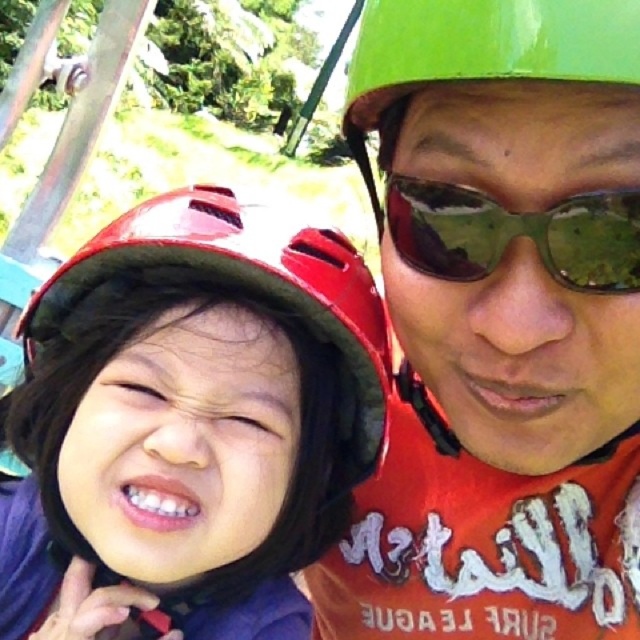
Which of these two, glossy red helmet at left or green reflective sunglasses at upper center, stands shorter?

green reflective sunglasses at upper center is shorter.

Identify the location of glossy red helmet at left. (189, 422).

Can you confirm if green matte helmet at upper center is positioned below green reflective sunglasses at upper center?

Correct, green matte helmet at upper center is located below green reflective sunglasses at upper center.

Does point (444, 394) lie in front of point (499, 209)?

No, it is behind (499, 209).

Image resolution: width=640 pixels, height=640 pixels. Identify the location of green matte helmet at upper center. (509, 212).

Does glossy red helmet at left lie behind green matte helmet at upper center?

Yes, it is.

Is glossy red helmet at left positioned in front of green matte helmet at upper center?

Answer: No, glossy red helmet at left is behind green matte helmet at upper center.

Where is `glossy red helmet at left`? glossy red helmet at left is located at coordinates click(189, 422).